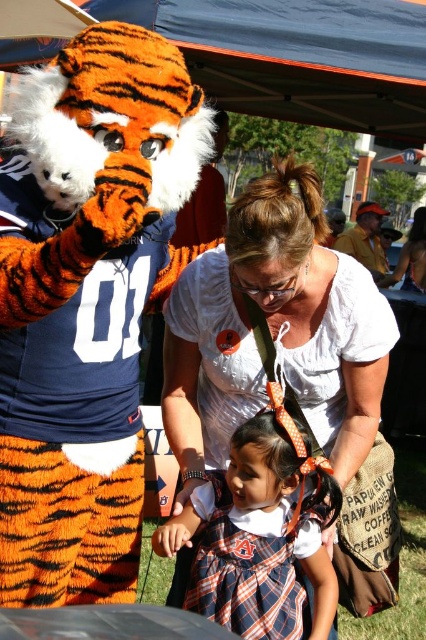
Question: Is white cotton shirt at center behind plaid fabric dress at center?

Choices:
 (A) no
 (B) yes

Answer: (A)

Question: Among these points, which one is nearest to the camera?

Choices:
 (A) (x=330, y=513)
 (B) (x=330, y=340)

Answer: (B)

Question: Which of the following is the closest to the observer?

Choices:
 (A) (259, 532)
 (B) (189, 330)

Answer: (A)

Question: Is white cotton shirt at center above plaid fabric dress at center?

Choices:
 (A) no
 (B) yes

Answer: (B)

Question: Is white cotton shirt at center positioned in front of plaid fabric dress at center?

Choices:
 (A) no
 (B) yes

Answer: (B)